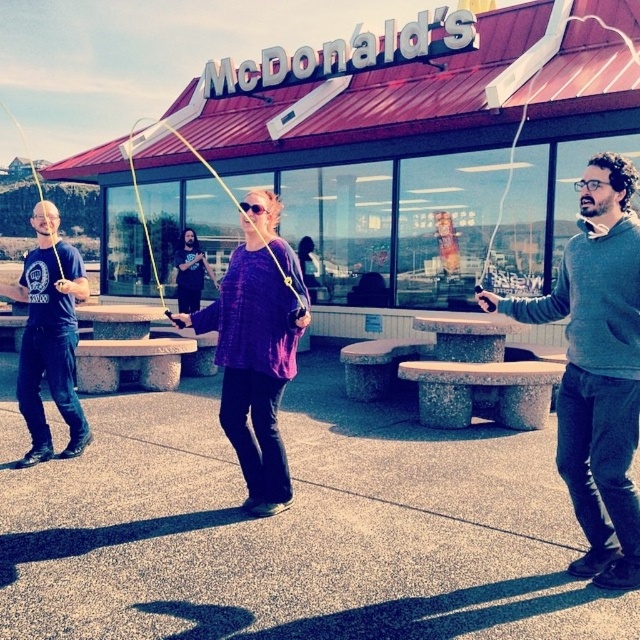
Question: Which point appears farthest from the camera in this image?

Choices:
 (A) (612, 468)
 (B) (268, 246)
 (C) (83, 419)
 (D) (186, 248)

Answer: (D)

Question: Is purple woven sweater at center bigger than matte black t-shirt at left?

Choices:
 (A) no
 (B) yes

Answer: (A)

Question: Can you confirm if matte black t-shirt at left is thinner than black matte shirt at center?

Choices:
 (A) no
 (B) yes

Answer: (A)

Question: Which object is positioned farthest from the gray sweater at right?

Choices:
 (A) purple woven sweater at center
 (B) black matte shirt at center
 (C) matte black t-shirt at left

Answer: (B)

Question: Is gray sweater at right below yellow rubber jump rope at center?

Choices:
 (A) yes
 (B) no

Answer: (A)

Question: Which object is farther from the camera taking this photo?

Choices:
 (A) gray sweater at right
 (B) yellow rubber jump rope at center
 (C) matte black t-shirt at left
 (D) purple woven sweater at center

Answer: (C)